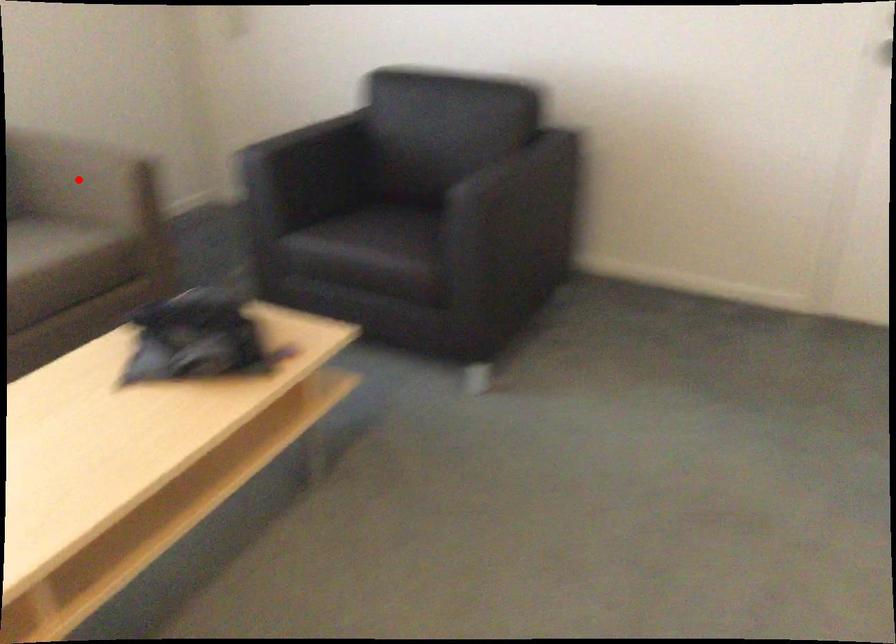
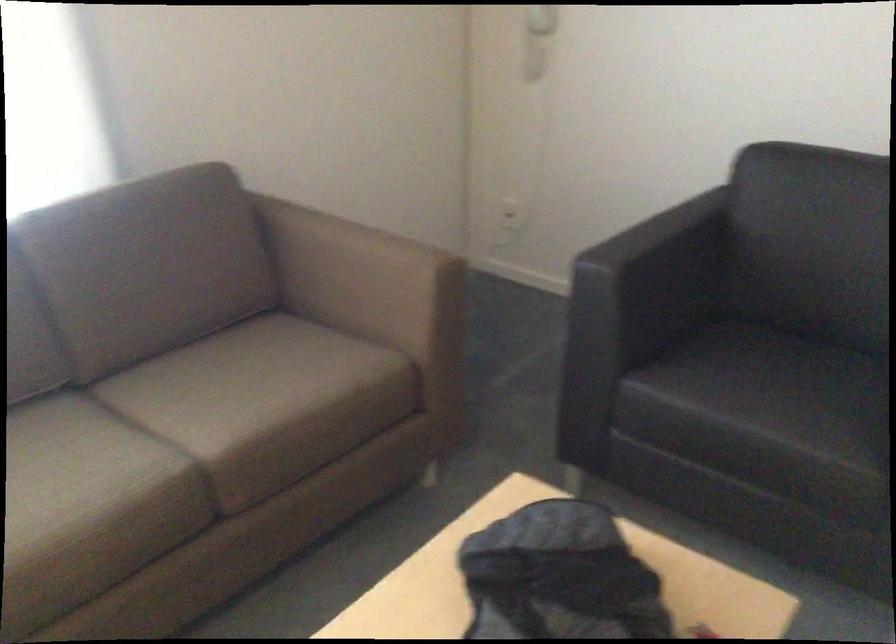
Find the pixel in the second image that matches the highlighted location in the first image.

(363, 277)